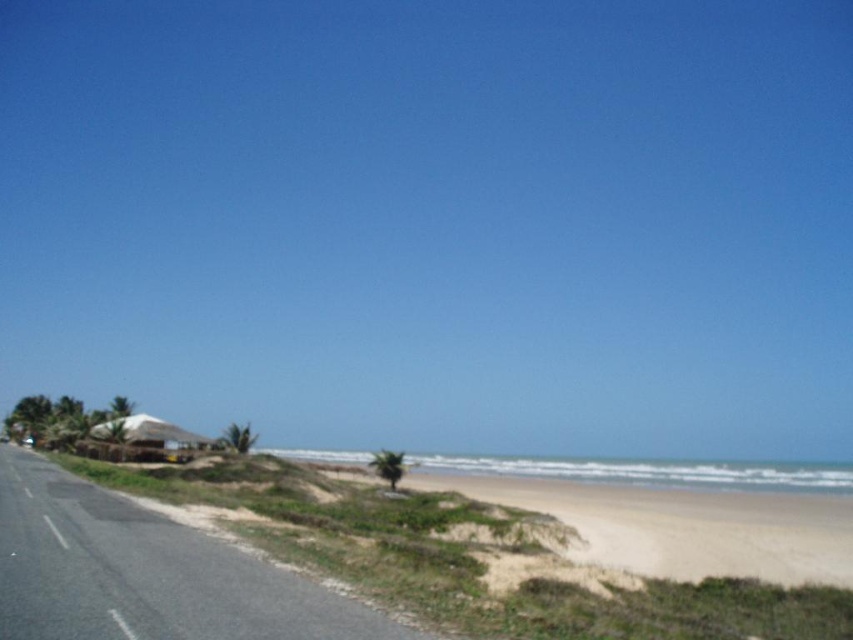
Between light beige sand at lower right and white thatched hut at lower left, which one appears on the right side from the viewer's perspective?

light beige sand at lower right

Which is in front, point (723, 568) or point (96, 436)?

Point (723, 568) is in front.

Which is behind, point (578, 504) or point (141, 416)?

The point (141, 416) is behind.

This screenshot has height=640, width=853. Find the location of `light beige sand at lower right`. light beige sand at lower right is located at coordinates (677, 524).